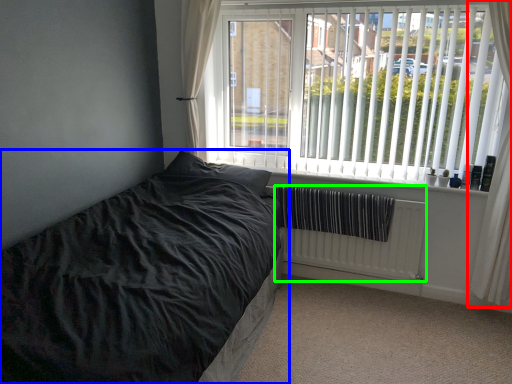
Question: Based on their relative distances, which object is farther from curtain (highlighted by a red box)? Choose from bed (highlighted by a blue box) and radiator (highlighted by a green box).

Choices:
 (A) bed
 (B) radiator

Answer: (A)